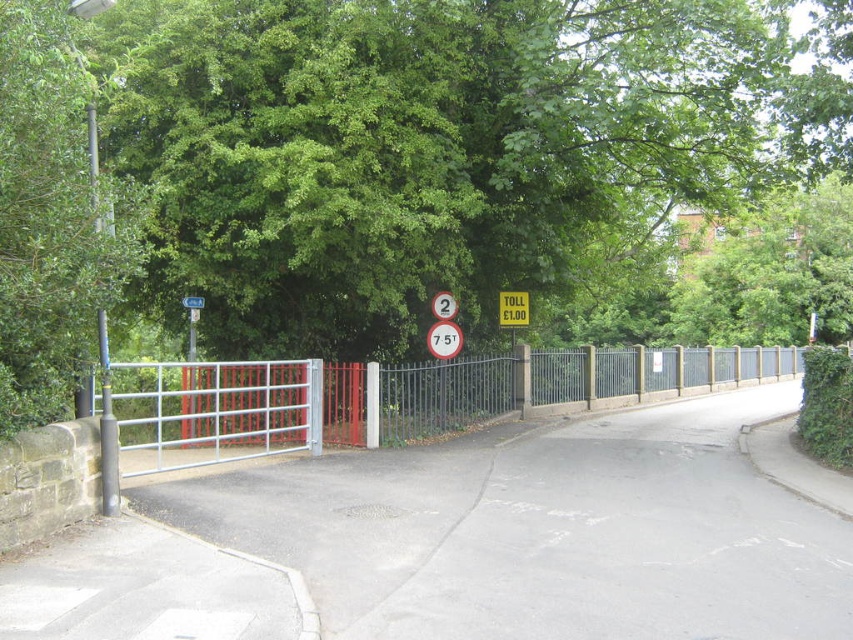
Can you confirm if metallic gate at center is taller than metallic gate at left?

Yes, metallic gate at center is taller than metallic gate at left.

Identify the location of metallic gate at center. (397, 397).

Which is behind, point (312, 390) or point (189, 432)?

Point (189, 432)

What are the coordinates of `metallic gate at center` in the screenshot? It's located at (397, 397).

Does metallic gate at center have a greater height compared to yellow matte toll sign at center?

Yes, metallic gate at center is taller than yellow matte toll sign at center.

The height and width of the screenshot is (640, 853). Identify the location of metallic gate at center. (397, 397).

Where is `metallic gate at center`? metallic gate at center is located at coordinates (397, 397).

Locate an element on the screen. The width and height of the screenshot is (853, 640). metallic gate at center is located at coordinates (397, 397).

Is point (445, 292) positioned behind point (200, 307)?

That is True.

You are a GUI agent. You are given a task and a screenshot of the screen. Output one action in this format:
    pyautogui.click(x=<x>, y=<y>)
    Task: Click on the red plastic sign at center
    This screenshot has height=640, width=853.
    Given the screenshot: What is the action you would take?
    pos(444,305)